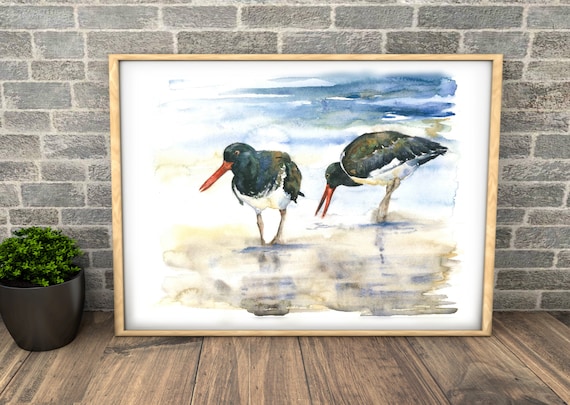
This screenshot has width=570, height=405. Find the location of `wood floor`. wood floor is located at coordinates (231, 369).